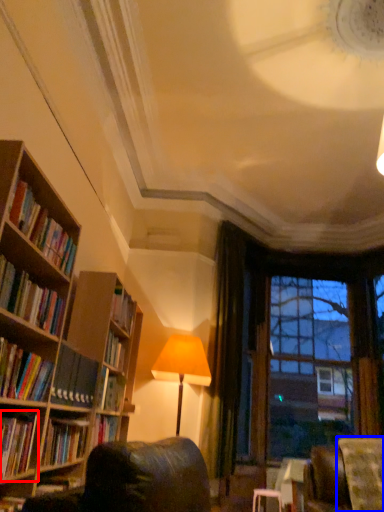
Question: Which object is further to the camera taking this photo, book (highlighted by a red box) or swivel chair (highlighted by a blue box)?

Choices:
 (A) book
 (B) swivel chair

Answer: (B)